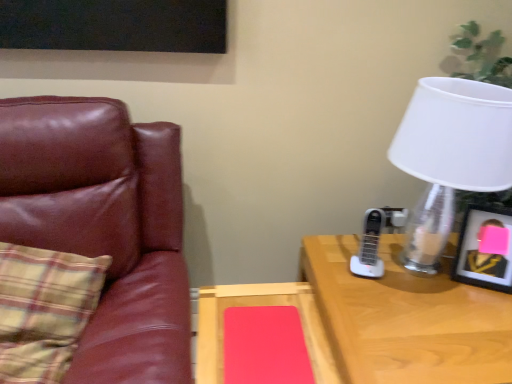
Question: Can you confirm if white matte lampshade at upper right is positioned to the right of plaid fabric pillow at left?

Choices:
 (A) no
 (B) yes

Answer: (B)

Question: Can you confirm if white matte lampshade at upper right is bigger than plaid fabric pillow at left?

Choices:
 (A) no
 (B) yes

Answer: (A)

Question: From a real-world perspective, is white matte lampshade at upper right on top of plaid fabric pillow at left?

Choices:
 (A) yes
 (B) no

Answer: (A)

Question: Does white matte lampshade at upper right have a lesser width compared to plaid fabric pillow at left?

Choices:
 (A) yes
 (B) no

Answer: (A)

Question: Considering the relative sizes of white matte lampshade at upper right and plaid fabric pillow at left in the image provided, is white matte lampshade at upper right taller than plaid fabric pillow at left?

Choices:
 (A) yes
 (B) no

Answer: (A)

Question: Relative to metallic silver picture frame at right, is wooden desk at right in front or behind?

Choices:
 (A) front
 (B) behind

Answer: (A)

Question: Do you think wooden desk at right is within metallic silver picture frame at right, or outside of it?

Choices:
 (A) inside
 (B) outside

Answer: (B)

Question: In terms of height, does wooden desk at right look taller or shorter compared to metallic silver picture frame at right?

Choices:
 (A) short
 (B) tall

Answer: (B)

Question: Is wooden desk at right to the left or to the right of metallic silver picture frame at right in the image?

Choices:
 (A) right
 (B) left

Answer: (B)

Question: Is point (492, 208) positioned closer to the camera than point (224, 301)?

Choices:
 (A) farther
 (B) closer

Answer: (A)

Question: From the image's perspective, is metallic silver picture frame at right located above or below matte wood table at center?

Choices:
 (A) above
 (B) below

Answer: (A)

Question: In terms of size, does metallic silver picture frame at right appear bigger or smaller than matte wood table at center?

Choices:
 (A) big
 (B) small

Answer: (B)

Question: From a real-world perspective, is metallic silver picture frame at right physically located above or below matte wood table at center?

Choices:
 (A) below
 (B) above

Answer: (B)

Question: Is white matte lampshade at upper right taller or shorter than metallic silver picture frame at right?

Choices:
 (A) tall
 (B) short

Answer: (A)

Question: In terms of width, does white matte lampshade at upper right look wider or thinner when compared to metallic silver picture frame at right?

Choices:
 (A) thin
 (B) wide

Answer: (B)